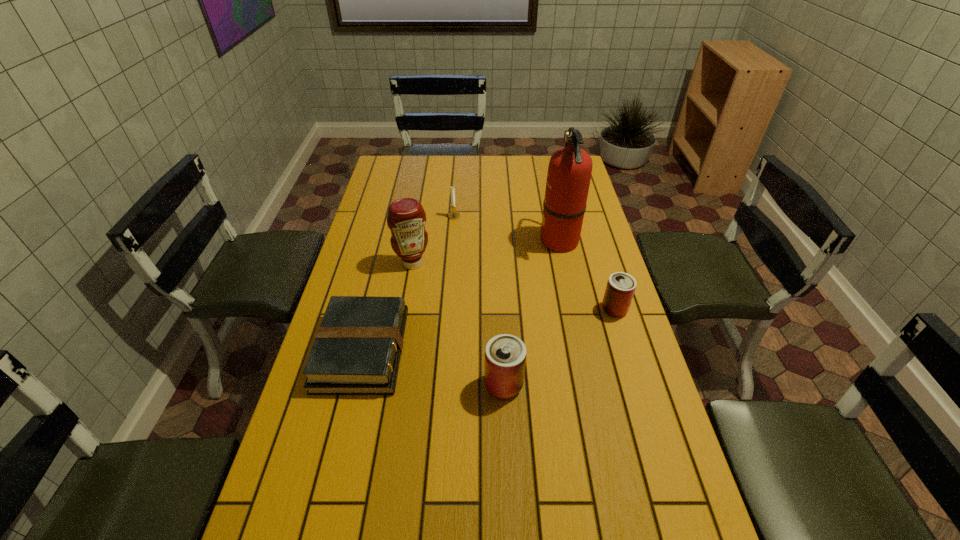
This screenshot has width=960, height=540. I want to click on the nearer can, so click(x=505, y=355).

The height and width of the screenshot is (540, 960). Identify the location of the left can. (505, 355).

Locate an element on the screen. This screenshot has height=540, width=960. the right can is located at coordinates (621, 286).

The width and height of the screenshot is (960, 540). I want to click on the shorter can, so click(x=621, y=286).

Where is `candle holder`? This screenshot has height=540, width=960. candle holder is located at coordinates (453, 215).

Find the location of a particular element. the farthest object is located at coordinates (453, 215).

I want to click on fire extinguisher, so click(x=569, y=173).

Locate an element on the screen. The width and height of the screenshot is (960, 540). the fifth object from left to right is located at coordinates (569, 173).

At what (x,y) coordinates should I click in order to perform the action: click on the second tallest object. Please return your answer as a coordinate pair (x, y). Looking at the image, I should click on (406, 218).

This screenshot has width=960, height=540. I want to click on hardback book, so click(x=357, y=349).